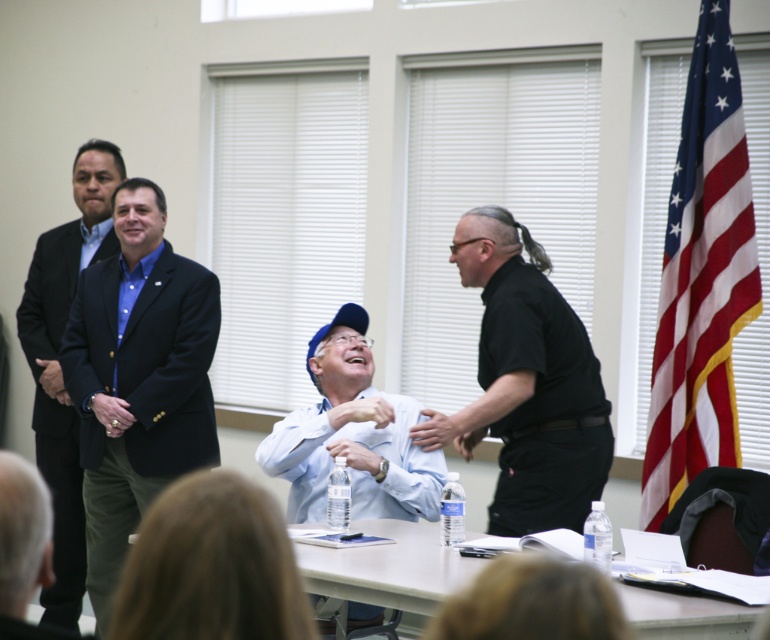
Question: Can you confirm if blue fabric cap at center is positioned above matte black suit at left?

Choices:
 (A) no
 (B) yes

Answer: (A)

Question: Which object appears farthest from the camera in this image?

Choices:
 (A) matte black blazer at left
 (B) white plastic table at lower center
 (C) blue fabric cap at center
 (D) matte black suit at left

Answer: (D)

Question: Does american flag at right have a smaller size compared to white plastic table at lower center?

Choices:
 (A) yes
 (B) no

Answer: (B)

Question: Among these objects, which one is farthest from the camera?

Choices:
 (A) matte black blazer at left
 (B) white plastic table at lower center
 (C) blue fabric cap at center
 (D) black matte shirt at right

Answer: (A)

Question: Can you confirm if black matte shirt at right is wider than white plastic table at lower center?

Choices:
 (A) yes
 (B) no

Answer: (A)

Question: Which point is closer to the camera taking this photo?

Choices:
 (A) (45, 420)
 (B) (77, 326)

Answer: (B)